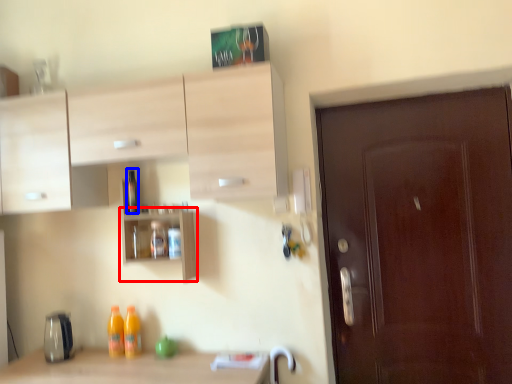
Question: Which object is closer to the camera taking this photo, shelf (highlighted by a red box) or bottle (highlighted by a blue box)?

Choices:
 (A) shelf
 (B) bottle

Answer: (A)